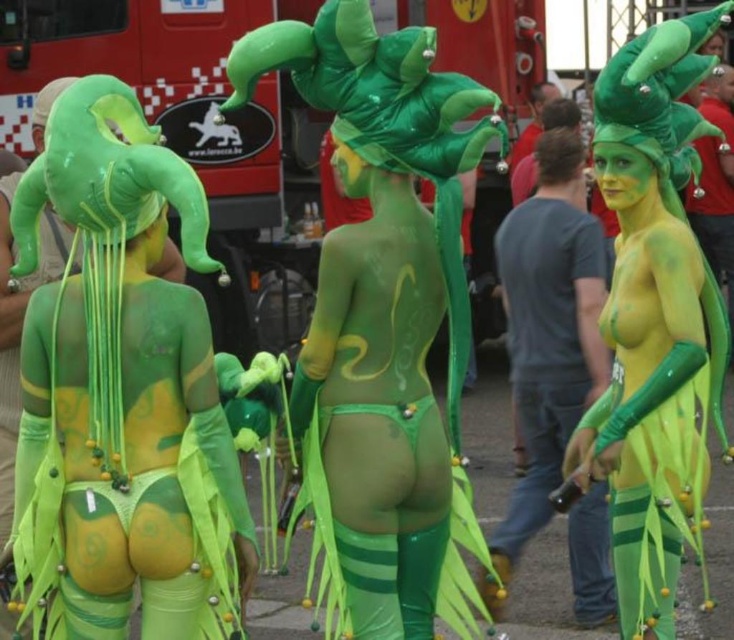
Question: Which of the following is the farthest from the observer?

Choices:
 (A) dark gray t-shirt at center
 (B) metallic red fire truck at upper left

Answer: (B)

Question: Is the position of metallic red fire truck at upper left more distant than that of dark gray t-shirt at center?

Choices:
 (A) no
 (B) yes

Answer: (B)

Question: From the image, what is the correct spatial relationship of matte green body paint at center in relation to metallic red fire truck at upper left?

Choices:
 (A) left
 (B) right

Answer: (B)

Question: Can you confirm if matte green body paint at center is positioned to the left of dark gray t-shirt at center?

Choices:
 (A) yes
 (B) no

Answer: (A)

Question: Which of the following is the farthest from the observer?

Choices:
 (A) (197, 396)
 (B) (592, 307)
 (C) (225, 33)

Answer: (C)

Question: Among these points, which one is farthest from the camera?

Choices:
 (A) (672, 49)
 (B) (18, 452)
 (C) (465, 241)
 (D) (512, 561)

Answer: (C)